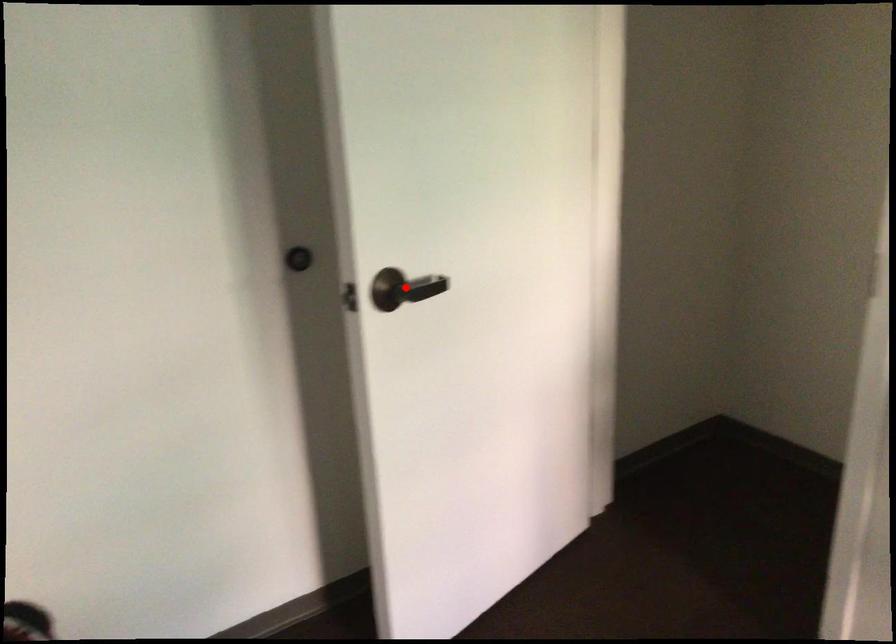
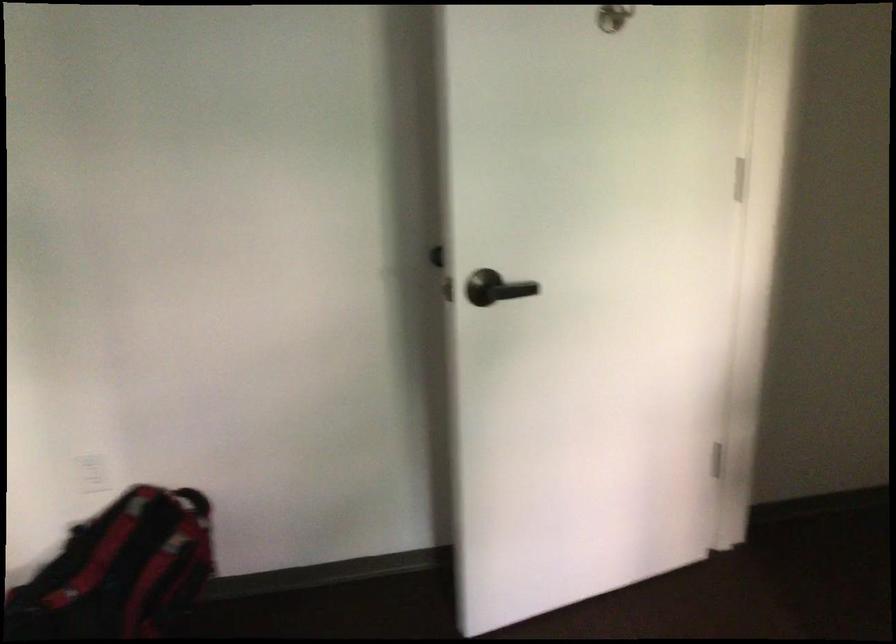
Find the pixel in the second image that matches the highlighted location in the first image.

(495, 288)